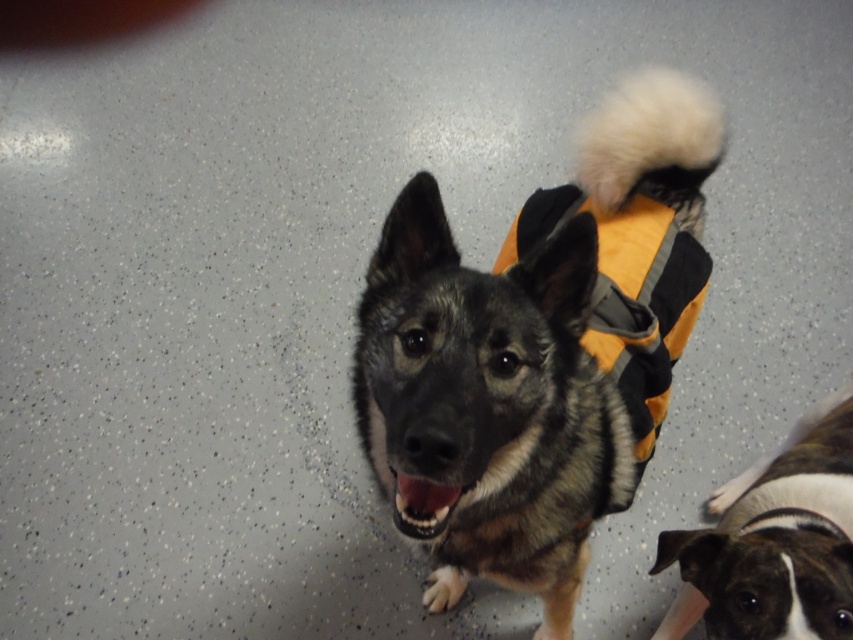
You are a dog trainer observing two dogs in an indoor area with a speckled gray floor. You see an orange fabric vest at center and a brown and white fur at lower right. Which object is taller?

The orange fabric vest at center is much taller than the brown and white fur at lower right.

You are a photographer standing at the front of the room. You want to take a photo of both the orange fabric vest at center and the brown and white fur at lower right. Which one will appear larger in your photo?

The orange fabric vest at center will appear larger in the photo because it is closer to the viewer than the brown and white fur at lower right.

Consider the image. You are a dog trainer observing the scene. You need to determine if the orange fabric vest at center is within reach of your 24 inch long training tool. Can you confirm if the vest is within reach?

The orange fabric vest at center is 31.76 inches from viewer. Since the training tool is 24 inches long, the vest is beyond the tool reach.